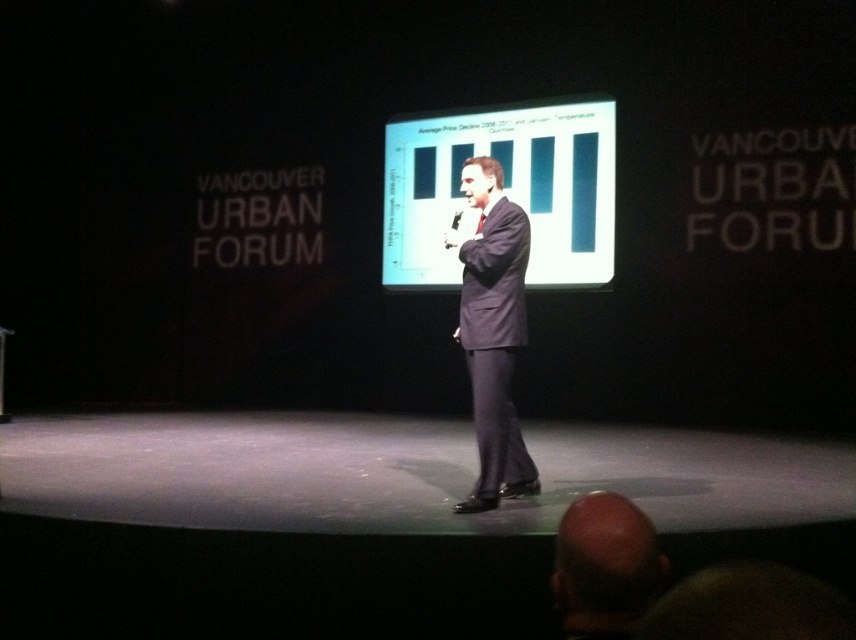
Does point (593, 602) lie in front of point (452, 224)?

Yes, point (593, 602) is closer to viewer.

Who is more distant from viewer, [633,598] or [456,243]?

The point [456,243] is more distant.

You are a GUI agent. You are given a task and a screenshot of the screen. Output one action in this format:
    pyautogui.click(x=<x>, y=<y>)
    Task: Click on the smooth bald head at lower center
    This screenshot has height=640, width=856.
    Given the screenshot: What is the action you would take?
    pyautogui.click(x=604, y=566)

Consider the image. Can you confirm if dark suit at center is positioned to the left of black plastic microphone at center?

No, dark suit at center is not to the left of black plastic microphone at center.

Is dark suit at center smaller than black plastic microphone at center?

Actually, dark suit at center might be larger than black plastic microphone at center.

Where is `dark suit at center`? dark suit at center is located at coordinates (492, 333).

Locate an element on the screen. The width and height of the screenshot is (856, 640). dark suit at center is located at coordinates (492, 333).

Can you confirm if matte white graph at center is positioned below black plastic microphone at center?

Incorrect, matte white graph at center is not positioned below black plastic microphone at center.

Can you confirm if matte white graph at center is positioned to the left of black plastic microphone at center?

In fact, matte white graph at center is to the right of black plastic microphone at center.

Between point (550, 120) and point (459, 236), which one is positioned in front?

Point (459, 236)

Identify the location of matte white graph at center. The image size is (856, 640). (504, 189).